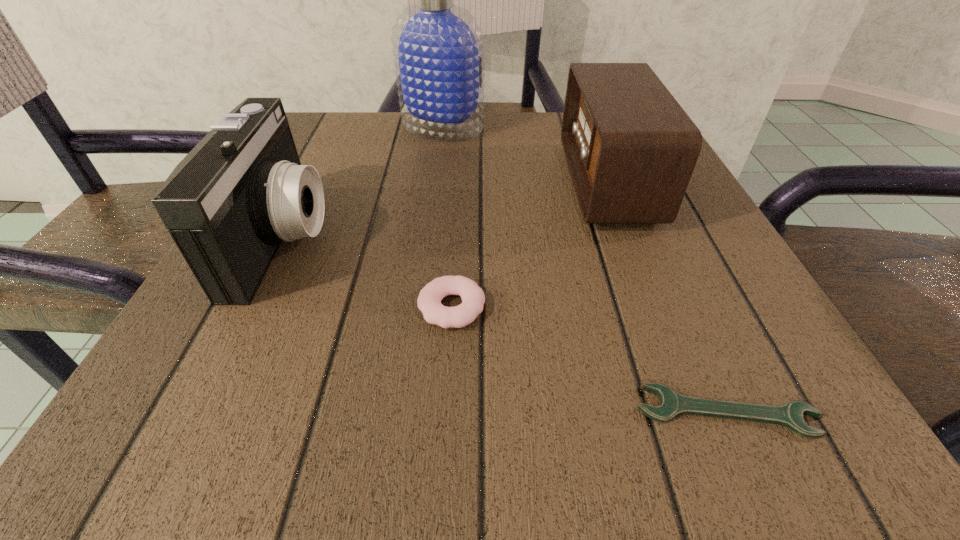
You are a GUI agent. You are given a task and a screenshot of the screen. Output one action in this format:
    pyautogui.click(x=<x>, y=<y>)
    Task: Click on the empty location between the doughnut and the nearest object
    This screenshot has width=960, height=540.
    Given the screenshot: What is the action you would take?
    pyautogui.click(x=589, y=359)

Find the location of a particular element. free point between the tallest object and the leftmost object is located at coordinates (363, 183).

This screenshot has width=960, height=540. I want to click on free space between the leftmost object and the farthest object, so click(363, 183).

Locate an element on the screen. free area in between the tallest object and the radio receiver is located at coordinates (525, 155).

Locate an element on the screen. Image resolution: width=960 pixels, height=540 pixels. empty location between the tallest object and the leftmost object is located at coordinates (363, 183).

Find the location of a particular element. Image resolution: width=960 pixels, height=540 pixels. vacant area that lies between the second shortest object and the cleansing agent is located at coordinates (447, 217).

Select which object appears as the second closest to the radio receiver. Please provide its 2D coordinates. Your answer should be formatted as a tuple, i.e. [(x, y)], where the tuple contains the x and y coordinates of a point satisfying the conditions above.

[(429, 300)]

Point out which object is positioned as the nearest to the radio receiver. Please provide its 2D coordinates. Your answer should be formatted as a tuple, i.e. [(x, y)], where the tuple contains the x and y coordinates of a point satisfying the conditions above.

[(438, 46)]

Find the location of `free space that satisfies the following two spatial constraints: 1. on the front side of the cleansing agent; 2. on the lens of the camcorder`. free space that satisfies the following two spatial constraints: 1. on the front side of the cleansing agent; 2. on the lens of the camcorder is located at coordinates (427, 238).

I want to click on blank area in the image that satisfies the following two spatial constraints: 1. on the front side of the tallest object; 2. on the lens of the leftmost object, so click(x=427, y=238).